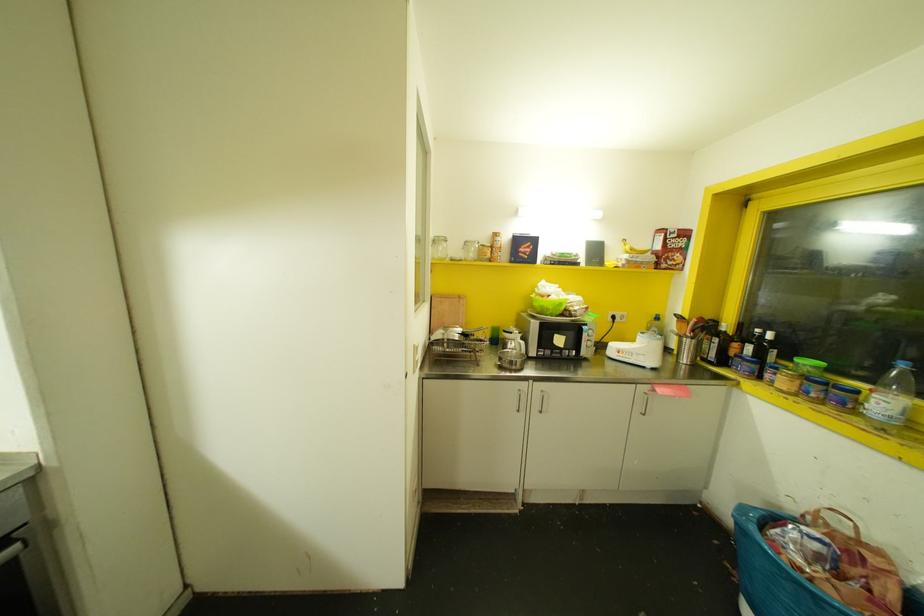
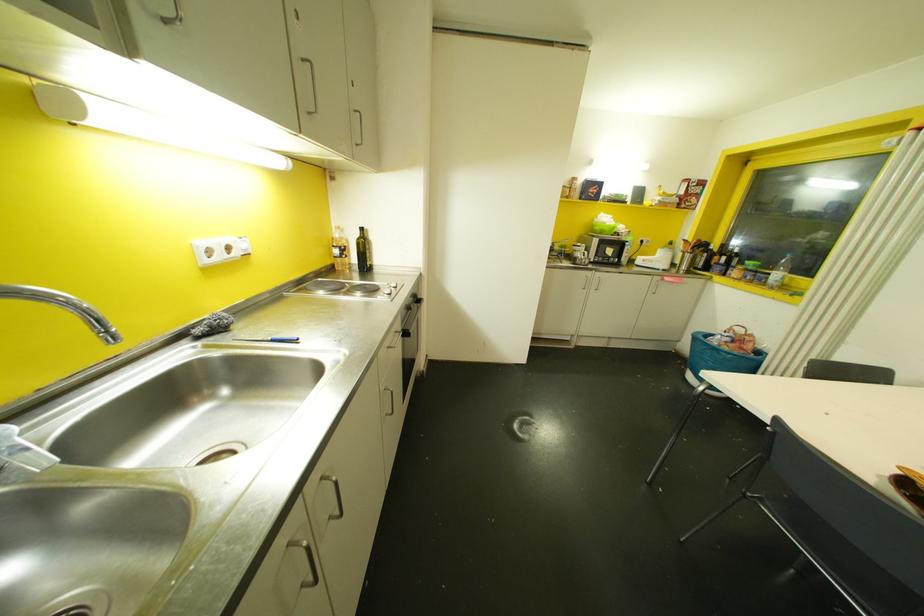
Where in the second image is the point corresponding to (x=535, y=407) from the first image?

(592, 286)